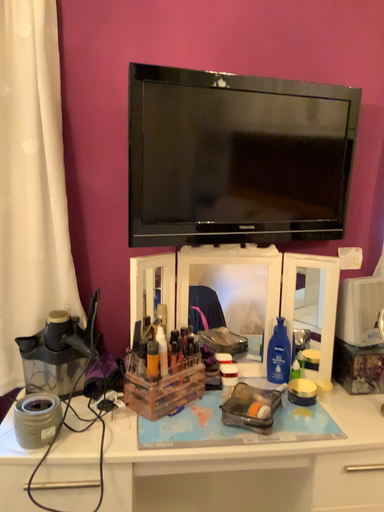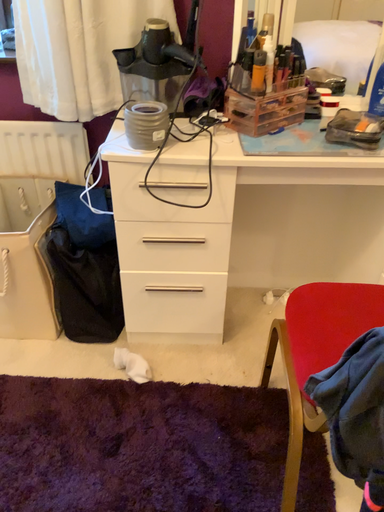
Question: How did the camera likely rotate when shooting the video?

Choices:
 (A) rotated upward
 (B) rotated downward

Answer: (B)